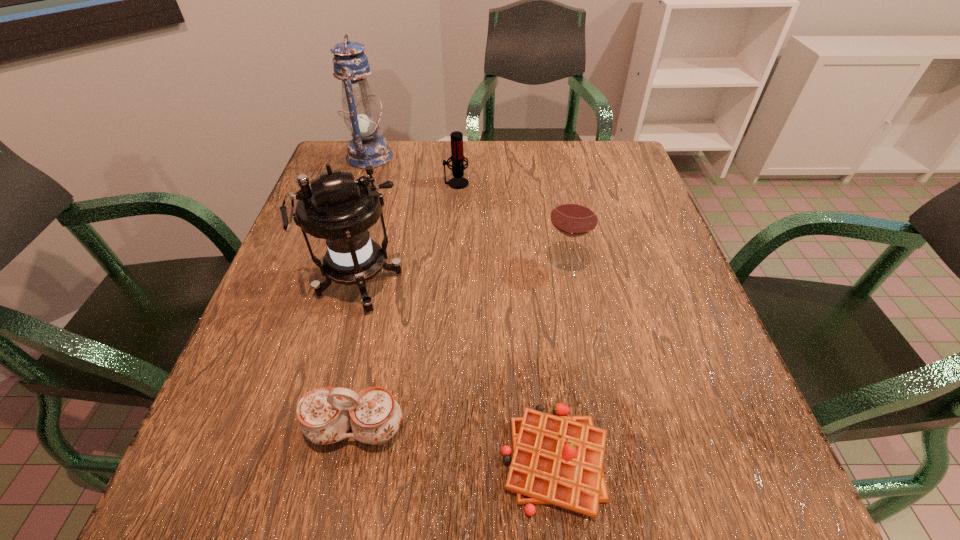
Image resolution: width=960 pixels, height=540 pixels. Find the location of `the farther lantern`. the farther lantern is located at coordinates 366,148.

Find the location of `the nearer lantern`. the nearer lantern is located at coordinates (340, 210).

Where is `wineglass`? wineglass is located at coordinates click(574, 214).

I want to click on microphone, so click(x=458, y=182).

Where is `the third object from right to left`? The height and width of the screenshot is (540, 960). the third object from right to left is located at coordinates (458, 182).

You are a GUI agent. You are given a task and a screenshot of the screen. Output one action in this format:
    pyautogui.click(x=<x>, y=<y>)
    Task: Click on the chinaware
    The width and height of the screenshot is (960, 540).
    Given the screenshot: What is the action you would take?
    pyautogui.click(x=325, y=417)

This screenshot has height=540, width=960. I want to click on the shortest object, so click(x=558, y=460).

You are a GUI agent. You are given a task and a screenshot of the screen. Output one action in this format:
    pyautogui.click(x=<x>, y=<y>)
    Task: Click on the vacant space located on the front-facing side of the farther lantern
    
    Given the screenshot: What is the action you would take?
    pos(521,157)

Identify the location of vacant position located 0.280m on the back of the nearer lantern. This screenshot has height=540, width=960. (384, 187).

You are a GUI agent. You are given a task and a screenshot of the screen. Output one action in this format:
    pyautogui.click(x=<x>, y=<y>)
    Task: Click on the free space located on the front of the wineglass
    
    Given the screenshot: What is the action you would take?
    pyautogui.click(x=577, y=332)